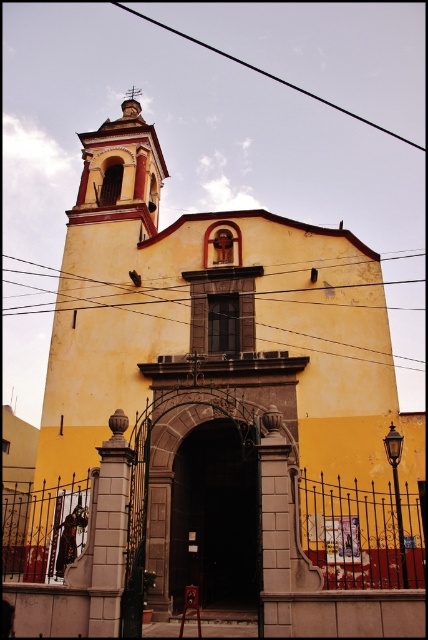
Consider the image. Who is taller, black wire at upper center or metallic wire at center?

With more height is black wire at upper center.

Is point (359, 120) positioned in front of point (95, 282)?

No, (359, 120) is further to viewer.

Which is in front, point (332, 108) or point (330, 288)?

Point (330, 288) is in front.

The image size is (428, 640). In order to click on black wire at upper center in this screenshot , I will do `click(267, 74)`.